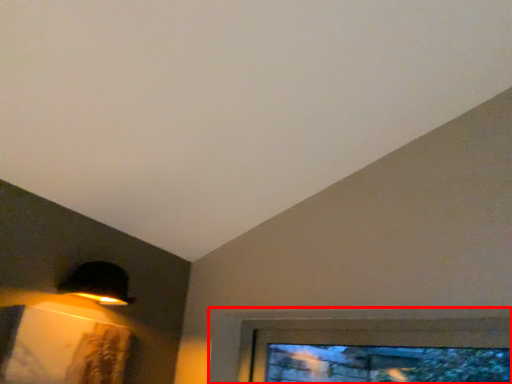
Question: From the image's perspective, what is the correct spatial positioning of window (annotated by the red box) in reference to lamp?

Choices:
 (A) below
 (B) above

Answer: (A)